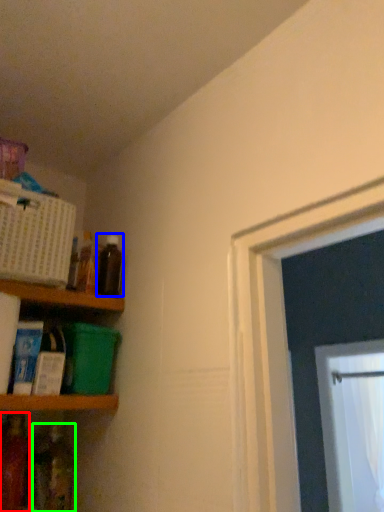
Question: Which is nearer to the bottle (highlighted by a red box)? bottle (highlighted by a blue box) or bottle (highlighted by a green box).

Choices:
 (A) bottle
 (B) bottle

Answer: (B)